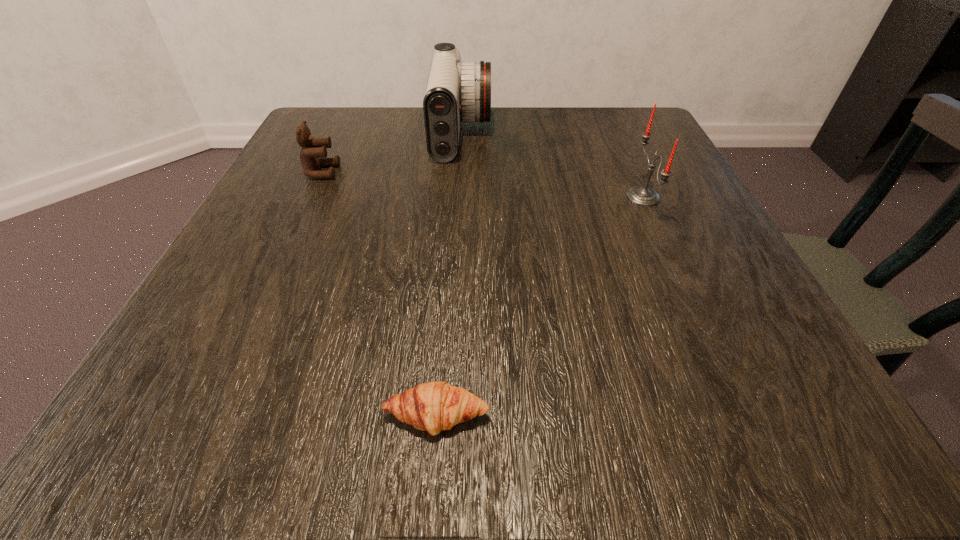
Find the location of `free space located on the face of the leftmost object`. free space located on the face of the leftmost object is located at coordinates (497, 172).

At what (x,y) coordinates should I click in order to perform the action: click on object located at the far edge. Please return your answer as a coordinate pair (x, y). The height and width of the screenshot is (540, 960). Looking at the image, I should click on [456, 91].

The width and height of the screenshot is (960, 540). I want to click on object that is at the near edge, so click(x=434, y=406).

Where is `object that is at the left edge`? The image size is (960, 540). object that is at the left edge is located at coordinates (313, 153).

Where is `object at the right edge`? The width and height of the screenshot is (960, 540). object at the right edge is located at coordinates (643, 196).

Where is `vacant area at the far edge of the desktop`? Image resolution: width=960 pixels, height=540 pixels. vacant area at the far edge of the desktop is located at coordinates (537, 141).

Identify the location of vacant position at the near edge of the desktop. This screenshot has height=540, width=960. coord(613,430).

Find the location of a particular element. This screenshot has height=540, width=960. free region at the left edge of the desktop is located at coordinates (265, 277).

In the image, there is a desktop. Identify the location of free space at the right edge. (768, 317).

In the image, there is a desktop. Identify the location of free region at the far left corner. click(x=334, y=111).